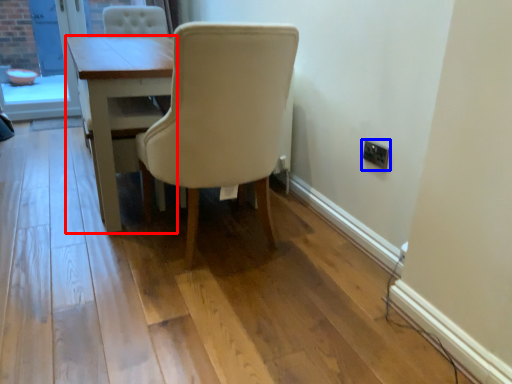
Question: Which object is further to the camera taking this photo, table (highlighted by a red box) or electric outlet (highlighted by a blue box)?

Choices:
 (A) table
 (B) electric outlet

Answer: (A)